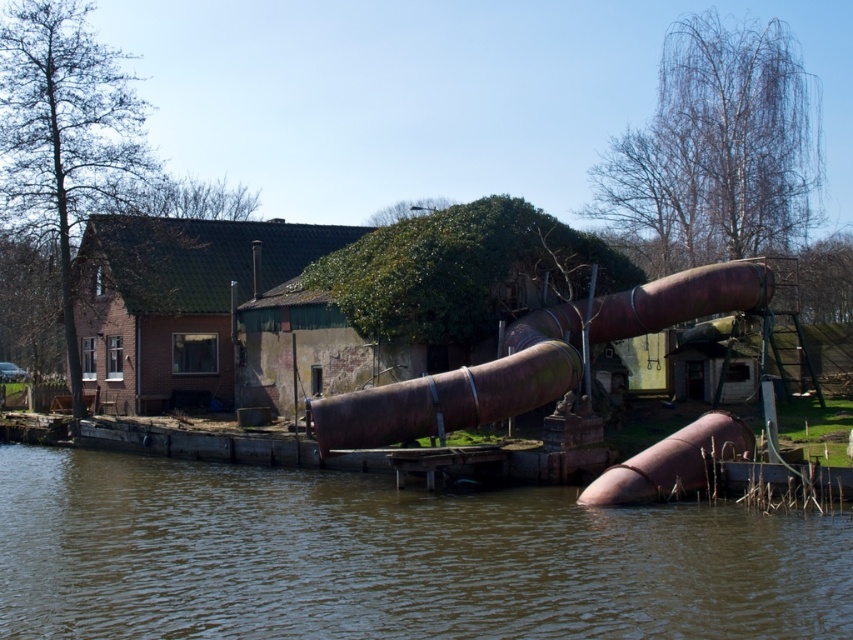
You are a maintenance worker assessing the scene. You need to determine if the brown muddy water at lower center can reach the base of the rusty metallic pipe at lower center. Based on their heights, what is your conclusion?

The brown muddy water at lower center is shorter than the rusty metallic pipe at lower center, so the water cannot reach the base of the rusty metallic pipe at lower center.

You are standing at the edge of the canal near the old industrial installation. There are two points marked in the scene. The first point is at coordinates point (x=479, y=401) and the second is at point (x=664, y=470). Which of these two points is closer to you?

Point (x=479, y=401) is closer to you because it is further to the viewer than point (x=664, y=470).